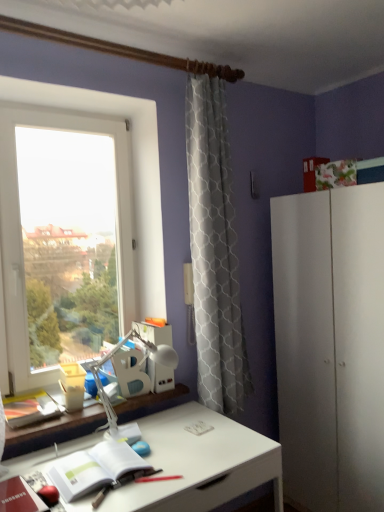
Find the location of a particular element. Image resolution: width=384 pixels, height=512 pixels. vacant space to the right of white plastic table lamp at center is located at coordinates (208, 436).